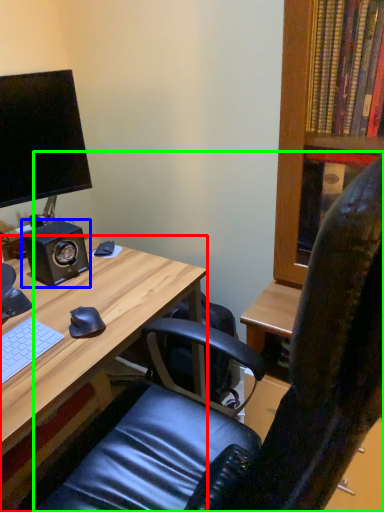
Question: Considering the real-world distances, which object is farthest from desk (highlighted by a red box)? speaker (highlighted by a blue box) or chair (highlighted by a green box)?

Choices:
 (A) speaker
 (B) chair

Answer: (B)